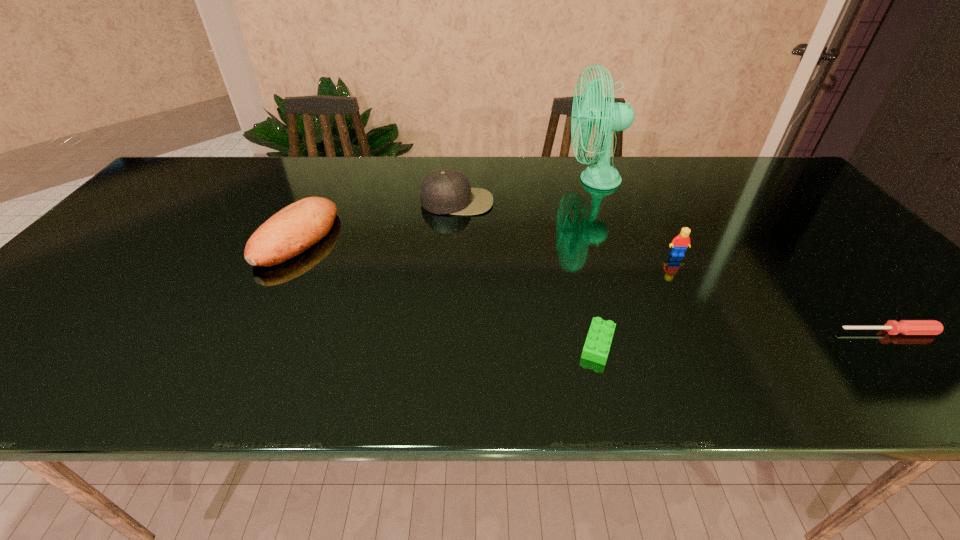
Image resolution: width=960 pixels, height=540 pixels. What are the coordinates of `object that is at the near edge` in the screenshot? It's located at (597, 345).

The image size is (960, 540). I want to click on object present at the right edge, so click(x=905, y=327).

In the image, there is a desktop. Identify the location of vacant space at the far edge. The width and height of the screenshot is (960, 540). (556, 179).

Where is `vacant space at the near edge`? This screenshot has width=960, height=540. vacant space at the near edge is located at coordinates (251, 389).

Where is `free space at the right edge`? Image resolution: width=960 pixels, height=540 pixels. free space at the right edge is located at coordinates (836, 226).

This screenshot has height=540, width=960. Identify the location of free space between the fifth shortest object and the rightmost object. (672, 267).

Locate an element on the screen. free space between the second object from right to left and the tallest object is located at coordinates (636, 217).

Identify the location of free space between the left Lego and the farther Lego. Image resolution: width=960 pixels, height=540 pixels. (637, 300).

Image resolution: width=960 pixels, height=540 pixels. Find the location of `free spot between the nearer Lego and the leftmost object`. free spot between the nearer Lego and the leftmost object is located at coordinates pos(447,291).

Locate an element on the screen. The image size is (960, 540). vacant area between the fifth shortest object and the screwdriver is located at coordinates (672, 267).